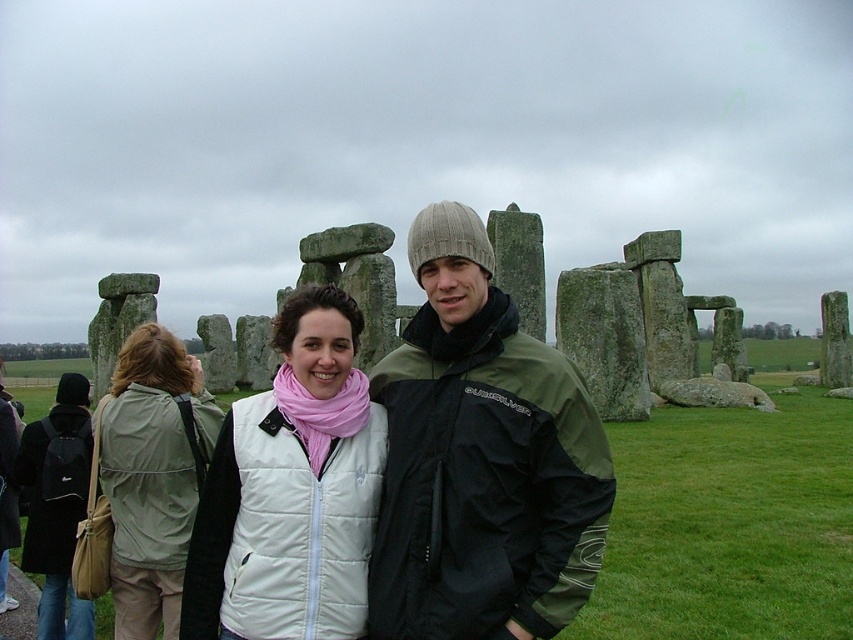
In the scene shown: You are a photographer at Stonehenge and want to take a photo that includes both the white puffy vest at center and the light beige fabric jacket at lower left. Which of these two items will appear closer to the camera in the photo?

The white puffy vest at center will appear closer to the camera because it is in front of the light beige fabric jacket at lower left.